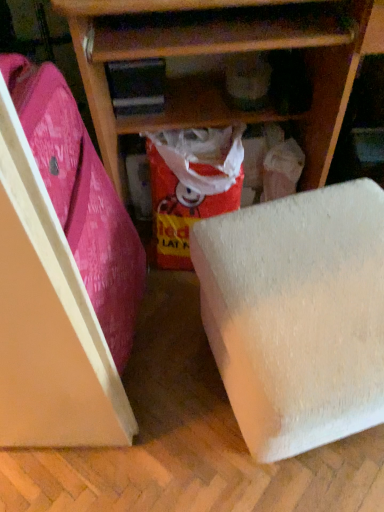
Question: Is pink fabric suitcase at left at the left side of red glossy paper at center?

Choices:
 (A) no
 (B) yes

Answer: (B)

Question: Does pink fabric suitcase at left turn towards red glossy paper at center?

Choices:
 (A) no
 (B) yes

Answer: (A)

Question: Is pink fabric suitcase at left beside red glossy paper at center?

Choices:
 (A) yes
 (B) no

Answer: (B)

Question: Is pink fabric suitcase at left oriented away from red glossy paper at center?

Choices:
 (A) no
 (B) yes

Answer: (A)

Question: Can you confirm if pink fabric suitcase at left is shorter than red glossy paper at center?

Choices:
 (A) no
 (B) yes

Answer: (A)

Question: Is white foam block at lower right taller or shorter than wooden shelf at center?

Choices:
 (A) short
 (B) tall

Answer: (A)

Question: Is point (375, 253) positioned closer to the camera than point (357, 60)?

Choices:
 (A) farther
 (B) closer

Answer: (B)

Question: Is white foam block at lower right inside or outside of wooden shelf at center?

Choices:
 (A) inside
 (B) outside

Answer: (B)

Question: Is white foam block at lower right wider or thinner than wooden shelf at center?

Choices:
 (A) thin
 (B) wide

Answer: (A)

Question: Is red glossy paper at center in front of or behind white foam block at lower right in the image?

Choices:
 (A) front
 (B) behind

Answer: (B)

Question: From their relative heights in the image, would you say red glossy paper at center is taller or shorter than white foam block at lower right?

Choices:
 (A) tall
 (B) short

Answer: (B)

Question: From a real-world perspective, is red glossy paper at center physically located above or below white foam block at lower right?

Choices:
 (A) above
 (B) below

Answer: (B)

Question: Considering the relative positions of red glossy paper at center and white foam block at lower right in the image provided, is red glossy paper at center to the left or to the right of white foam block at lower right?

Choices:
 (A) left
 (B) right

Answer: (A)

Question: From the image's perspective, is wooden shelf at center positioned above or below red glossy paper at center?

Choices:
 (A) above
 (B) below

Answer: (A)

Question: Considering their positions, is wooden shelf at center located in front of or behind red glossy paper at center?

Choices:
 (A) behind
 (B) front

Answer: (B)